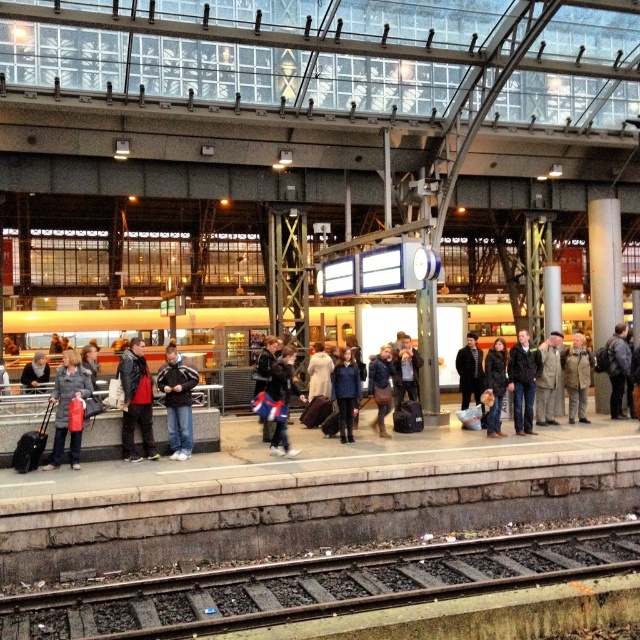
You are a delivery robot with a 30 feet long package. You need to move the package from the leather jacket at center to the khaki wool coat at center. Is there enough space to move the package without bending it?

The distance between the leather jacket at center and the khaki wool coat at center is 28.44 feet. Since the package is 30 feet long, it is slightly longer than the available space. Therefore, the package cannot be moved straight without bending it.

You are standing at the entrance of the train station platform. You want to board the metallic silver train at center. Which direction should you walk towards to reach the train?

The metallic silver train at center is located at point (83, 321), so you should walk towards the center of the platform to reach it.